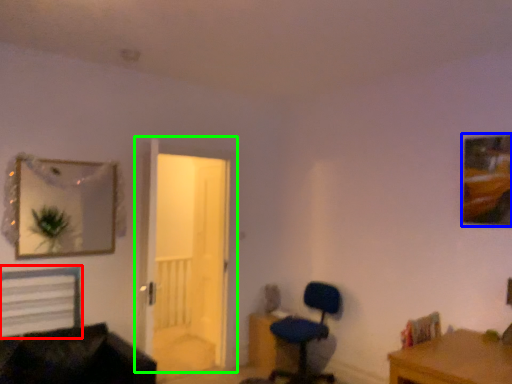
Question: Estimate the real-world distances between objects in this image. Which object is closer to bed (highlighted by a red box), picture frame (highlighted by a blue box) or door (highlighted by a green box)?

Choices:
 (A) picture frame
 (B) door

Answer: (B)